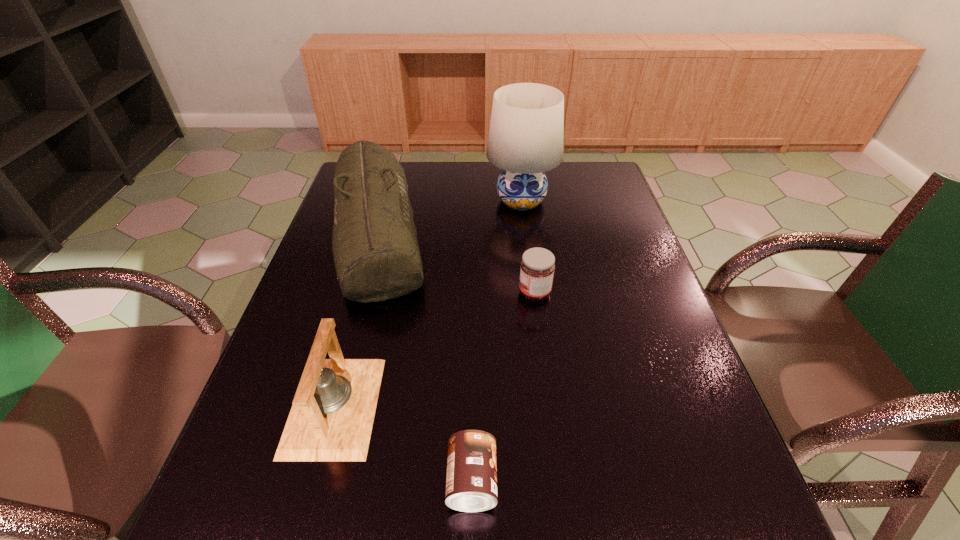
Identify the location of lampshade located in the far edge section of the desktop. (525, 140).

Identify the location of duffel bag positioned at the far edge. pyautogui.click(x=377, y=257).

The image size is (960, 540). In order to click on object at the near edge in this screenshot , I will do `click(471, 483)`.

This screenshot has width=960, height=540. In order to click on duffel bag that is positioned at the left edge in this screenshot , I will do `click(377, 257)`.

Where is `bell at the left edge`? This screenshot has height=540, width=960. bell at the left edge is located at coordinates (331, 419).

Locate an element on the screen. The height and width of the screenshot is (540, 960). object present at the far left corner is located at coordinates (377, 257).

Where is `blank space at the left edge`? Image resolution: width=960 pixels, height=540 pixels. blank space at the left edge is located at coordinates (334, 265).

This screenshot has height=540, width=960. In the image, there is a desktop. What are the coordinates of `vacant space at the right edge` in the screenshot? It's located at (572, 202).

Identify the location of free space at the near left corner of the desktop. The height and width of the screenshot is (540, 960). (251, 534).

Find the location of `vacant space at the far right corner`. vacant space at the far right corner is located at coordinates (573, 165).